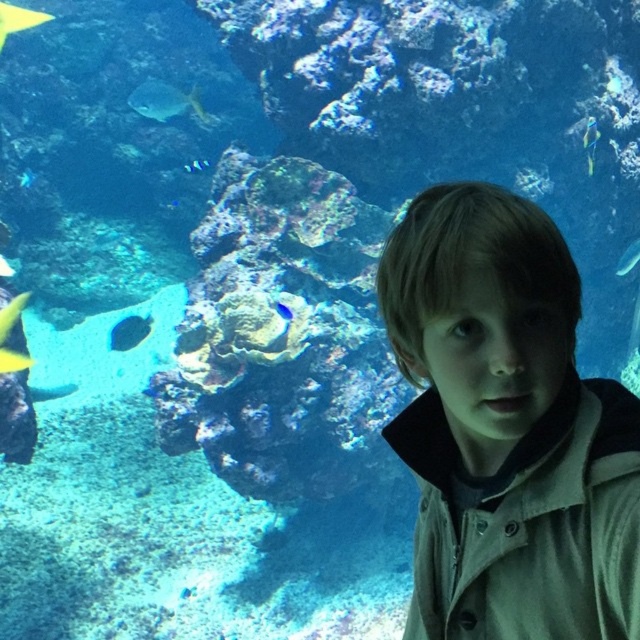
Question: Is light brown hair at right to the left of shiny blue fish at center-left from the viewer's perspective?

Choices:
 (A) yes
 (B) no

Answer: (B)

Question: Does shiny blue fish at lower left have a larger size compared to blue iridescent fish at upper right?

Choices:
 (A) yes
 (B) no

Answer: (A)

Question: Does shiny blue fish at upper center have a lesser width compared to blue iridescent fish at upper right?

Choices:
 (A) yes
 (B) no

Answer: (B)

Question: Which of the following is the closest to the observer?

Choices:
 (A) (595, 128)
 (B) (566, 548)

Answer: (B)

Question: Which point appears farthest from the camera in this image?

Choices:
 (A) (582, 122)
 (B) (500, 544)
 (C) (595, 145)

Answer: (A)

Question: Which point appears closest to the camera in this image?

Choices:
 (A) (56, 387)
 (B) (634, 257)

Answer: (B)